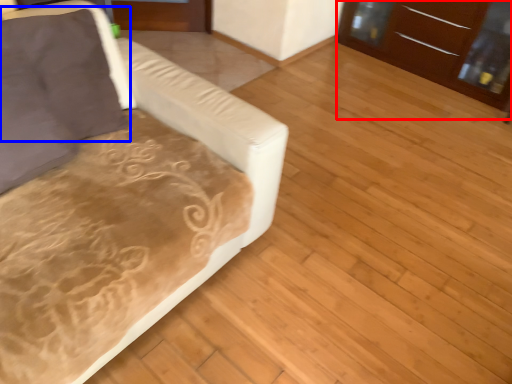
Question: Which object is closer to the camera taking this photo, dresser (highlighted by a red box) or pillow (highlighted by a blue box)?

Choices:
 (A) dresser
 (B) pillow

Answer: (B)